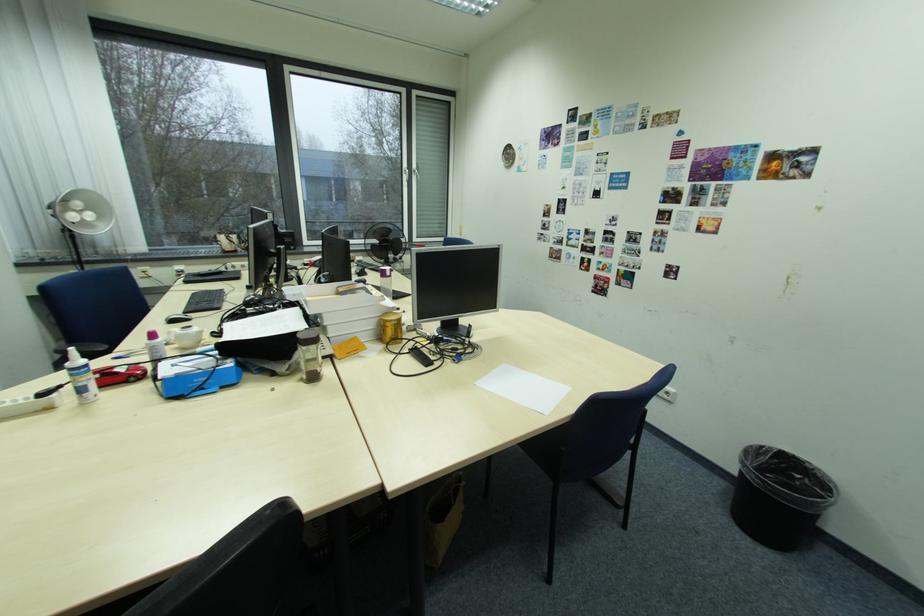
Find where to click the black computer mouse. Please return your answer as a coordinate pair (x, y).

(177, 318)